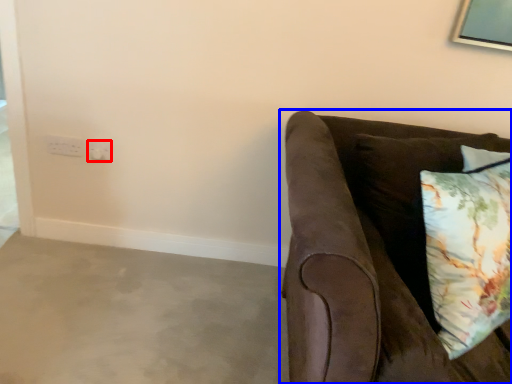
Question: Which object appears farthest to the camera in this image, electric outlet (highlighted by a red box) or studio couch (highlighted by a blue box)?

Choices:
 (A) electric outlet
 (B) studio couch

Answer: (A)